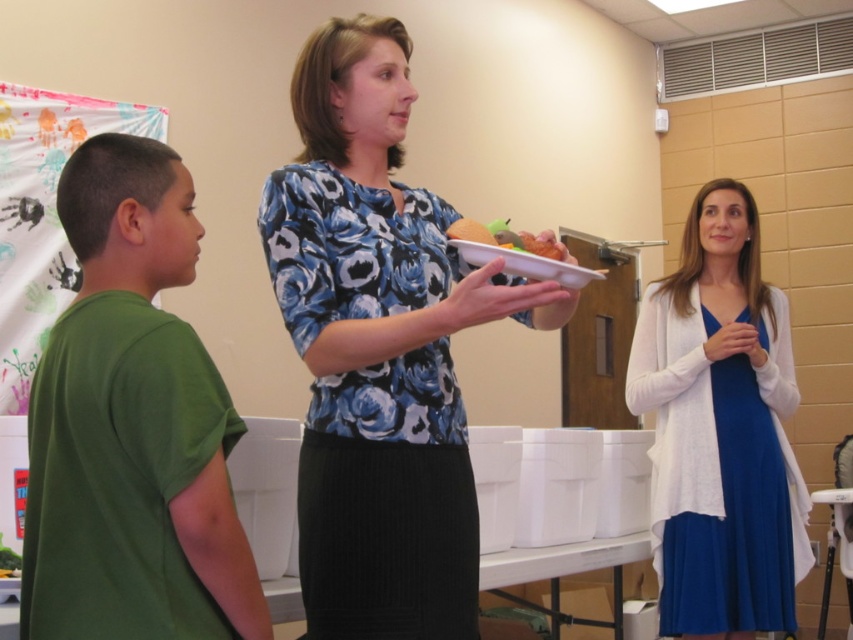
This screenshot has height=640, width=853. Find the location of `floral-patterned blouse at center`. floral-patterned blouse at center is located at coordinates (379, 349).

Measure the distance from floral-patterned blouse at center to blue satin dress at right.

floral-patterned blouse at center is 4.12 feet away from blue satin dress at right.

Between point (381, 58) and point (705, 531), which one is positioned behind?

Positioned behind is point (705, 531).

Where is `floral-patterned blouse at center`? floral-patterned blouse at center is located at coordinates (379, 349).

Which of these two, green matte t-shirt at left or blue satin dress at right, stands shorter?

green matte t-shirt at left

Can you confirm if green matte t-shirt at left is taller than blue satin dress at right?

No, green matte t-shirt at left is not taller than blue satin dress at right.

Between point (76, 490) and point (664, 353), which one is positioned in front?

Point (76, 490) is more forward.

The height and width of the screenshot is (640, 853). I want to click on green matte t-shirt at left, so click(x=132, y=426).

Can you confirm if green matte t-shirt at left is thinner than shiny plastic tray at center?

No, green matte t-shirt at left is not thinner than shiny plastic tray at center.

Who is shorter, green matte t-shirt at left or shiny plastic tray at center?

shiny plastic tray at center

Between point (91, 563) and point (526, 240), which one is positioned in front?

Point (91, 563)

Locate an element on the screen. green matte t-shirt at left is located at coordinates (132, 426).